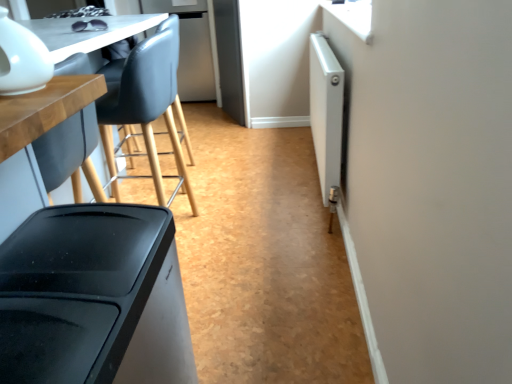
Question: Does point (0, 57) appear closer or farther from the camera than point (318, 71)?

Choices:
 (A) closer
 (B) farther

Answer: (A)

Question: In terms of size, does white glossy teapot at upper left, which is counted as the 1th appliance, starting from the left, appear bigger or smaller than white metallic radiator at right, placed as the 2th appliance when sorted from front to back?

Choices:
 (A) small
 (B) big

Answer: (A)

Question: Which of these objects is positioned farthest from the white glossy teapot at upper left, which is counted as the 1th appliance, starting from the left?

Choices:
 (A) matte wood table at left
 (B) white metallic radiator at right, which is the 2th appliance from left to right

Answer: (B)

Question: Based on their relative distances, which object is farther from the white metallic radiator at right, the first appliance from the back?

Choices:
 (A) white glossy teapot at upper left, the second appliance viewed from the right
 (B) matte wood table at left

Answer: (A)